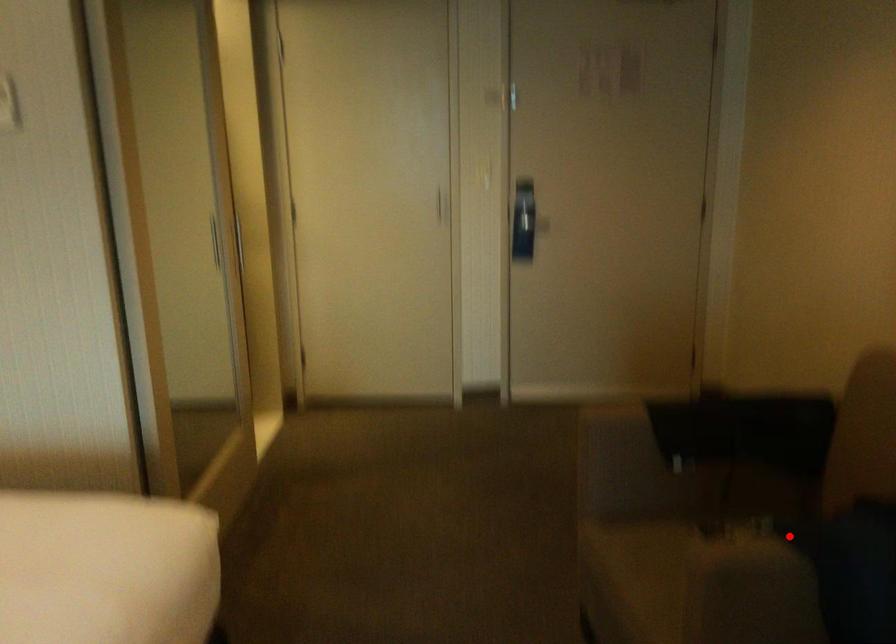
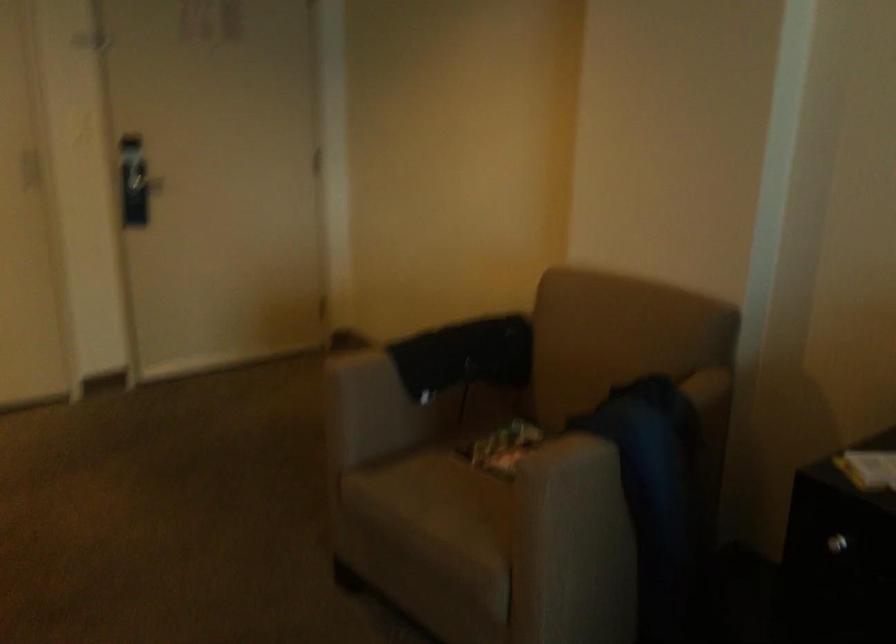
In the second image, find the point that corresponds to the highlighted location in the first image.

(597, 433)